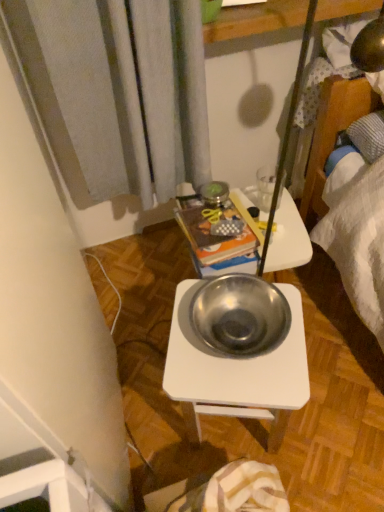
What is the approximate height of metallic silver bowl at center?

metallic silver bowl at center is 3.36 inches tall.

In order to face metallic books at center, should I rotate leftwards or rightwards?

→ You should rotate right by 3.892 degrees.

Find the location of `transparent glass at upper center`. transparent glass at upper center is located at coordinates (266, 186).

The height and width of the screenshot is (512, 384). I want to click on metallic white desk at center, so click(236, 372).

How many degrees apart are the facing directions of metallic books at center and metallic silver bowl at center?

The facing directions of metallic books at center and metallic silver bowl at center are 72.8 degrees apart.

Which of these two, metallic books at center or metallic silver bowl at center, is bigger?

metallic books at center.

Between metallic books at center and metallic silver bowl at center, which one appears on the left side from the viewer's perspective?

From the viewer's perspective, metallic books at center appears more on the left side.

Based on their positions, is metallic white desk at center located to the left or right of metallic books at center?

Based on their positions, metallic white desk at center is located to the right of metallic books at center.

Identify the location of desk located below the metallic books at center (from the image's perspective). (236, 372).

Looking at their sizes, would you say metallic white desk at center is wider or thinner than metallic books at center?

Considering their sizes, metallic white desk at center looks broader than metallic books at center.

From the image's perspective, between metallic white desk at center and metallic books at center, who is located below?

metallic white desk at center.

Looking at this image, is metallic silver bowl at center far from transparent glass at upper center?

No, metallic silver bowl at center is not far away from transparent glass at upper center.

Which is correct: metallic silver bowl at center is inside transparent glass at upper center, or outside of it?

metallic silver bowl at center exists outside the volume of transparent glass at upper center.

Does metallic silver bowl at center have a smaller size compared to transparent glass at upper center?

Incorrect, metallic silver bowl at center is not smaller in size than transparent glass at upper center.

From a real-world perspective, is metallic silver bowl at center on transparent glass at upper center?

Yes.

Is metallic silver bowl at center oriented towards metallic books at center?

No, metallic silver bowl at center is not facing towards metallic books at center.

Find the location of a particular element. This screenshot has width=384, height=512. bowl in front of the metallic books at center is located at coordinates (240, 316).

Does metallic silver bowl at center touch metallic books at center?

They are not placed beside each other.

From a real-world perspective, is metallic white desk at center above or below transparent glass at upper center?

Clearly, from a real-world perspective, metallic white desk at center is below transparent glass at upper center.

What's the angular difference between metallic white desk at center and transparent glass at upper center's facing directions?

The angular difference between metallic white desk at center and transparent glass at upper center is 63.1 degrees.

Who is taller, metallic white desk at center or transparent glass at upper center?

With more height is metallic white desk at center.

From a real-world perspective, is transparent glass at upper center located higher than metallic white desk at center?

Yes, from a real-world perspective, transparent glass at upper center is on top of metallic white desk at center.

In terms of height, does transparent glass at upper center look taller or shorter compared to metallic white desk at center?

Considering their sizes, transparent glass at upper center has less height than metallic white desk at center.

Could you tell me if transparent glass at upper center is facing metallic white desk at center?

No, transparent glass at upper center is not aimed at metallic white desk at center.

Would you say transparent glass at upper center is inside or outside metallic white desk at center?

transparent glass at upper center is spatially situated outside metallic white desk at center.

Could you tell me if transparent glass at upper center is turned towards metallic silver bowl at center?

No, transparent glass at upper center is not facing towards metallic silver bowl at center.

Considering the sizes of objects transparent glass at upper center and metallic silver bowl at center in the image provided, who is wider, transparent glass at upper center or metallic silver bowl at center?

metallic silver bowl at center.

Is transparent glass at upper center with metallic silver bowl at center?

No, transparent glass at upper center is not in contact with metallic silver bowl at center.

The height and width of the screenshot is (512, 384). What are the coordinates of `bowl above the metallic books at center (from a real-world perspective)` in the screenshot? It's located at (240, 316).

Find the location of a particular element. table lying behind the metallic white desk at center is located at coordinates (288, 238).

From the image, which object appears to be farther from transparent glass at upper center, metallic books at center or metallic white desk at center?

metallic white desk at center lies further to transparent glass at upper center than the other object.

Considering their positions, is metallic books at center positioned further to metallic white desk at center than metallic silver bowl at center?

metallic books at center is positioned further to the anchor metallic white desk at center.

Based on the photo, which object lies nearer to the anchor point transparent glass at upper center, metallic white desk at center or metallic silver bowl at center?

metallic silver bowl at center lies closer to transparent glass at upper center than the other object.

From the image, which object appears to be nearer to metallic silver bowl at center, metallic books at center or metallic white desk at center?

metallic white desk at center.

Considering their positions, is metallic white desk at center positioned closer to metallic books at center than metallic silver bowl at center?

metallic silver bowl at center is positioned closer to the anchor metallic books at center.

Based on their spatial positions, is metallic white desk at center or transparent glass at upper center further from metallic books at center?

metallic white desk at center.

From the image, which object appears to be nearer to metallic silver bowl at center, metallic white desk at center or transparent glass at upper center?

metallic white desk at center is closer to metallic silver bowl at center.

Looking at the image, which one is located further to metallic white desk at center, transparent glass at upper center or metallic silver bowl at center?

Based on the image, transparent glass at upper center appears to be further to metallic white desk at center.

Locate an element on the screen. This screenshot has width=384, height=512. bowl between transparent glass at upper center and metallic white desk at center in the up-down direction is located at coordinates (240, 316).

This screenshot has height=512, width=384. I want to click on table that lies between transparent glass at upper center and metallic white desk at center from top to bottom, so click(288, 238).

This screenshot has width=384, height=512. Find the location of `table located between metallic silver bowl at center and transparent glass at upper center in the depth direction`. table located between metallic silver bowl at center and transparent glass at upper center in the depth direction is located at coordinates (288, 238).

Image resolution: width=384 pixels, height=512 pixels. Find the location of `bowl between metallic books at center and metallic white desk at center from top to bottom`. bowl between metallic books at center and metallic white desk at center from top to bottom is located at coordinates (240, 316).